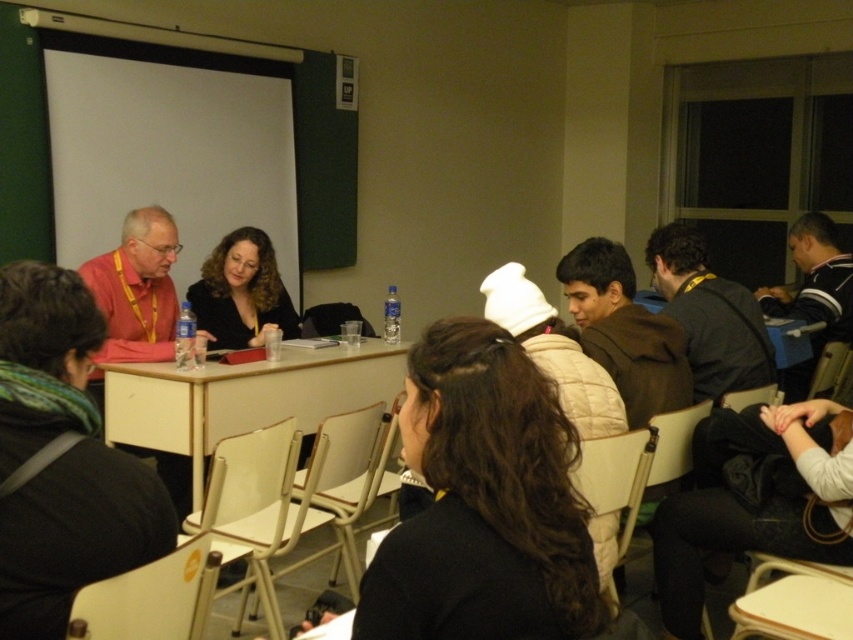
Question: Is beige wood table at center bigger than brown quilted jacket at center?

Choices:
 (A) no
 (B) yes

Answer: (B)

Question: Among these objects, which one is farthest from the camera?

Choices:
 (A) beige wood table at center
 (B) striped sweater at right
 (C) dark gray sweater at center right

Answer: (B)

Question: Does beige wood table at center appear under dark gray sweater at center right?

Choices:
 (A) yes
 (B) no

Answer: (A)

Question: Which object is the closest to the brown quilted jacket at center?

Choices:
 (A) black matte jacket at center
 (B) curly brown hair at center

Answer: (A)

Question: Among these objects, which one is farthest from the camera?

Choices:
 (A) brown quilted jacket at center
 (B) striped sweater at right
 (C) black matte jacket at center
 (D) curly brown hair at center

Answer: (B)

Question: Does dark brown hair at center appear on the left side of striped sweater at right?

Choices:
 (A) yes
 (B) no

Answer: (A)